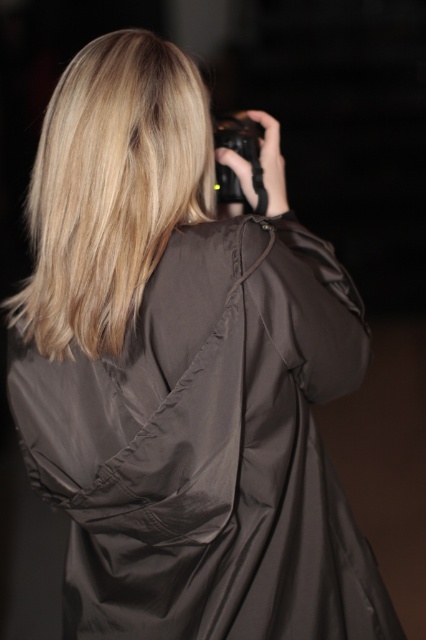
You are a photographer trying to capture a candid shot of the person in the image. Since both the blonde silky hair at upper center and the black rubber camera at upper center are in focus, which one is positioned lower in the frame?

The blonde silky hair at upper center is located below the black rubber camera at upper center, so it is positioned lower in the frame.

You are standing behind the person holding the camera. You need to place a small sticker on the point that is closer to you. Which point should you choose between the point at coordinate point (324, 634) and the point at coordinate point (235, 188)?

Point (235, 188) is closer to you because it is behind point (324, 634), which is in front of it.